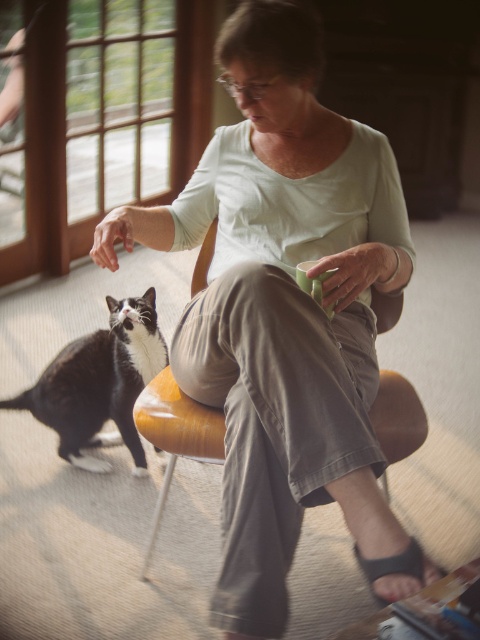
Which is below, black and white fur cat at lower left or wooden chair at center?

wooden chair at center is lower down.

From the picture: Between black and white fur cat at lower left and wooden chair at center, which one is positioned higher?

black and white fur cat at lower left is above.

Identify the location of black and white fur cat at lower left. The image size is (480, 640). (99, 384).

Between matte green shirt at center and wooden chair at center, which one is positioned lower?

Positioned lower is wooden chair at center.

Is matte green shirt at center thinner than wooden chair at center?

No, matte green shirt at center is not thinner than wooden chair at center.

Between point (360, 285) and point (394, 387), which one is positioned behind?

Positioned behind is point (394, 387).

Identify the location of matte green shirt at center. This screenshot has height=640, width=480. (286, 314).

Is matte green shirt at center below black and white fur cat at lower left?

Actually, matte green shirt at center is above black and white fur cat at lower left.

Is matte green shirt at center shorter than black and white fur cat at lower left?

No, matte green shirt at center is not shorter than black and white fur cat at lower left.

What do you see at coordinates (286, 314) in the screenshot? The height and width of the screenshot is (640, 480). I see `matte green shirt at center` at bounding box center [286, 314].

Image resolution: width=480 pixels, height=640 pixels. I want to click on matte green shirt at center, so click(286, 314).